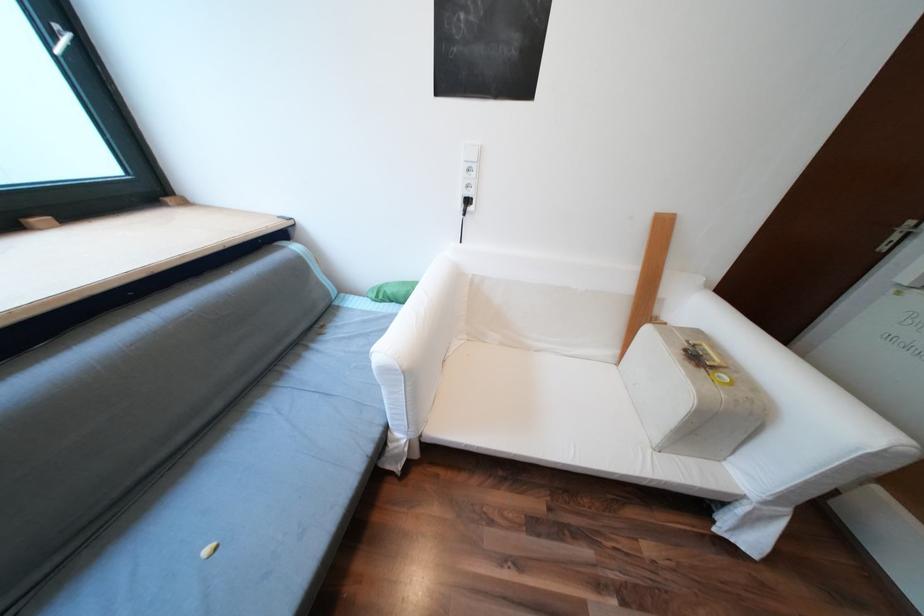
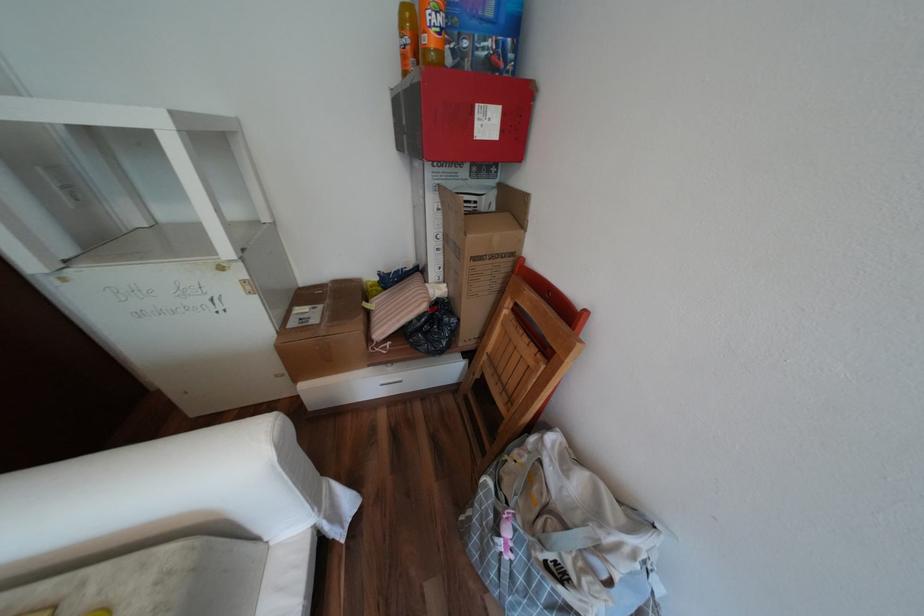
The images are taken continuously from a first-person perspective. In which direction is your viewpoint rotating?

The camera rotated toward right-down.